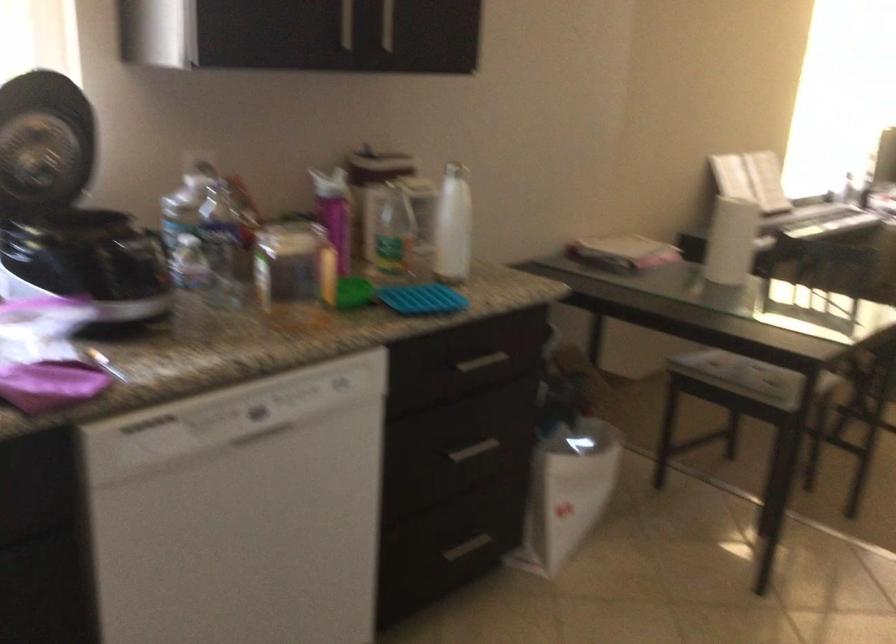
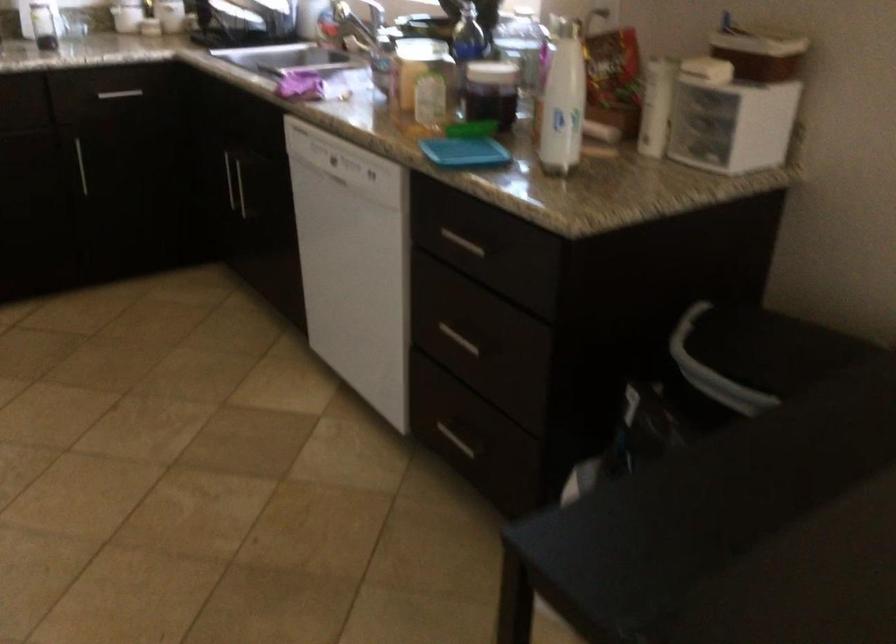
Find the pixel in the second image that matches [410,187] in the first image.

(563, 100)